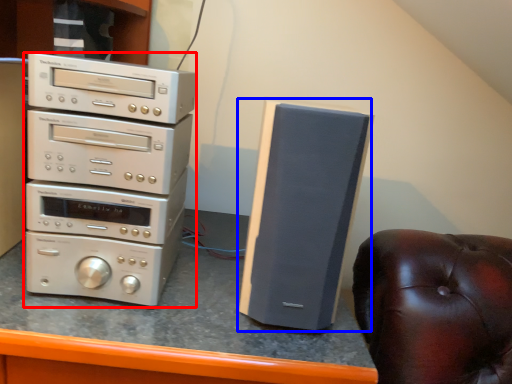
Question: Which point is closer to the camera, home appliance (highlighted by a red box) or speaker (highlighted by a blue box)?

Choices:
 (A) home appliance
 (B) speaker

Answer: (B)